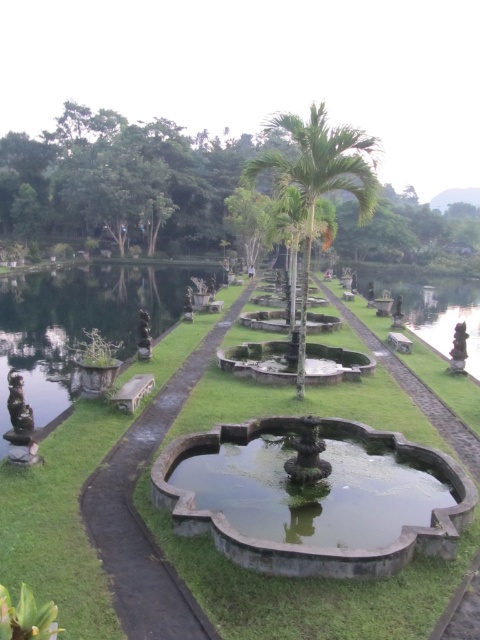
Describe the element at coordinates (319, 179) in the screenshot. I see `green leafy palm tree at center` at that location.

Who is more forward, [313,157] or [12,449]?

Positioned in front is point [12,449].

Between point (324, 112) and point (16, 400), which one is positioned in front?

Positioned in front is point (16, 400).

Image resolution: width=480 pixels, height=640 pixels. What are the coordinates of `green leafy palm tree at center` in the screenshot? It's located at (319, 179).

Which is above, green mossy stone fountain at center or bronze statue at left?

Positioned higher is bronze statue at left.

Is point (428, 554) positioned in front of point (36, 458)?

Yes.

Locate an element on the screen. The image size is (480, 640). green mossy stone fountain at center is located at coordinates 299,540.

Is green grass at center positioned at the back of green leafy palm tree at upper left?

That is False.

Is green grass at center closer to camera compared to green leafy palm tree at upper left?

Yes, it is.

Image resolution: width=480 pixels, height=640 pixels. What are the coordinates of `green grass at center` in the screenshot? It's located at (309, 592).

Find the location of a particular element. This screenshot has width=480, height=640. green grass at center is located at coordinates (309, 592).